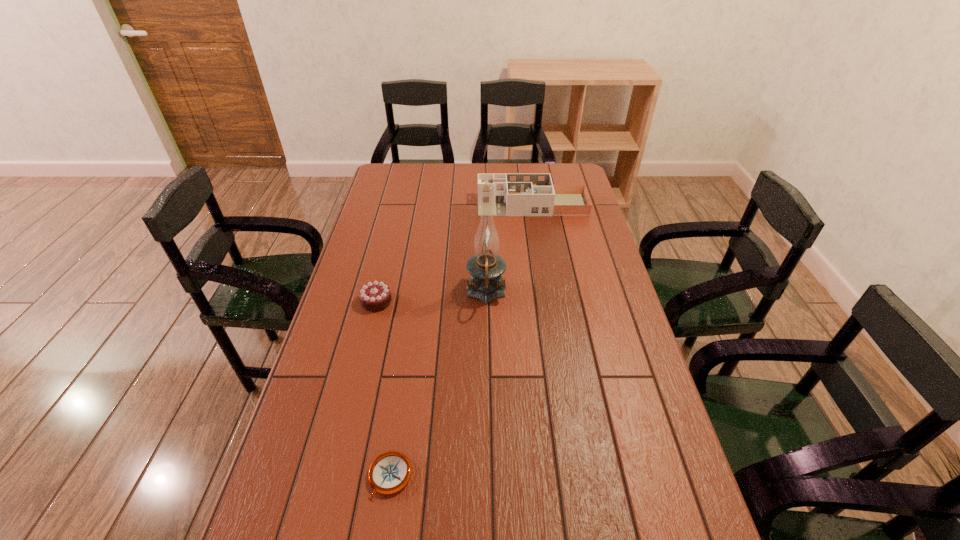
Identify the location of free space that is in between the dollhouse and the oil lamp. The width and height of the screenshot is (960, 540). (509, 249).

What are the coordinates of `free spot between the third object from right to left and the leftmost object` in the screenshot? It's located at (383, 389).

You are a GUI agent. You are given a task and a screenshot of the screen. Output one action in this format:
    pyautogui.click(x=<x>, y=<y>)
    Task: Click on the empty space that is in between the farthest object and the nearest object
    
    Given the screenshot: What is the action you would take?
    pyautogui.click(x=461, y=341)

You are a GUI agent. You are given a task and a screenshot of the screen. Output one action in this format:
    pyautogui.click(x=<x>, y=<y>)
    Task: Click on the vacant space that is in between the second shortest object and the compass
    This screenshot has width=960, height=540.
    Given the screenshot: What is the action you would take?
    pyautogui.click(x=383, y=389)

This screenshot has width=960, height=540. What are the coordinates of `free space between the dollhouse and the oil lamp` in the screenshot? It's located at (509, 249).

The height and width of the screenshot is (540, 960). What are the coordinates of `empty location between the third shortest object and the oil lamp` in the screenshot? It's located at (509, 249).

Identify the location of blank region between the compass and the dollhouse. The image size is (960, 540). (461, 341).

What are the coordinates of `unoccupied area between the third tallest object and the farthest object` in the screenshot? It's located at (454, 253).

I want to click on free space between the oil lamp and the third object from right to left, so click(438, 385).

At what (x,y) coordinates should I click in order to perform the action: click on vacant space that is in between the oil lamp and the dollhouse. Please return your answer as a coordinate pair (x, y). The image size is (960, 540). Looking at the image, I should click on (509, 249).